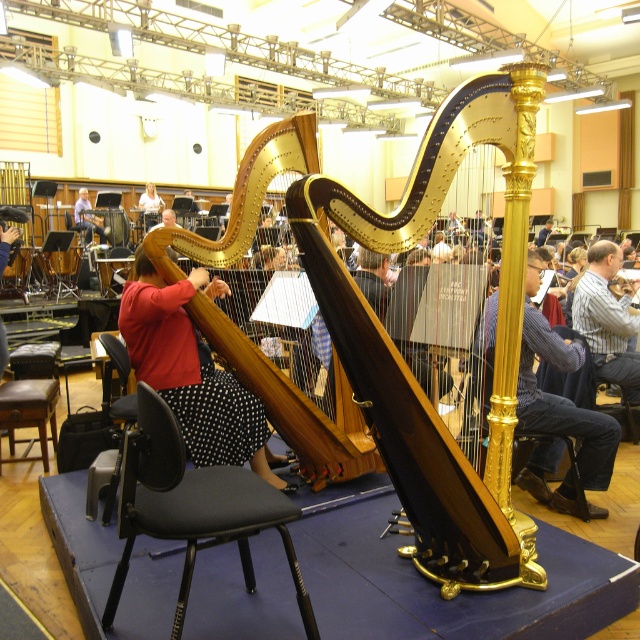
Question: Can you confirm if polished wood harp at center is positioned to the right of red fabric shirt at center?

Choices:
 (A) no
 (B) yes

Answer: (B)

Question: Considering the relative positions of black fabric chair at center and striped shirt at center in the image provided, where is black fabric chair at center located with respect to striped shirt at center?

Choices:
 (A) left
 (B) right

Answer: (A)

Question: Which of these objects is positioned closest to the red fabric shirt at center?

Choices:
 (A) red fabric dress at center
 (B) matte red shirt at center

Answer: (A)

Question: Which of the following is the closest to the observer?

Choices:
 (A) wooden harp at center
 (B) polished wood harp at center
 (C) black fabric chair at center
 (D) striped shirt at center

Answer: (C)

Question: Which point is farther from the camera taking this photo?

Choices:
 (A) (595, 483)
 (B) (602, 262)
 (C) (76, 216)

Answer: (C)

Question: Can you confirm if polished wood harp at center is positioned above red fabric shirt at center?

Choices:
 (A) no
 (B) yes

Answer: (A)